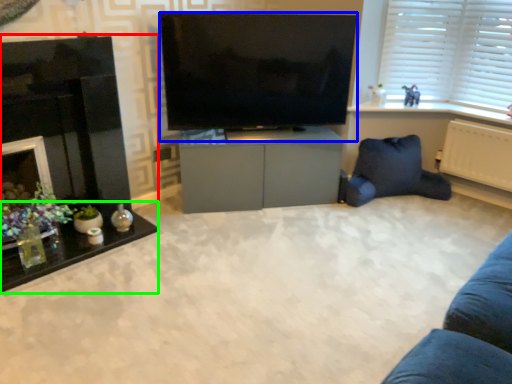
Question: Which object is positioned farthest from fireplace (highlighted by a red box)? Select from television (highlighted by a blue box) and table (highlighted by a green box).

Choices:
 (A) television
 (B) table

Answer: (A)